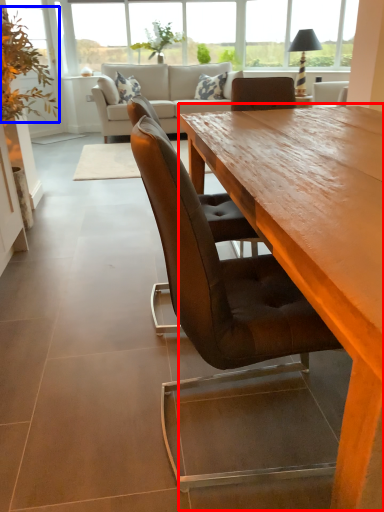
Question: Among these objects, which one is nearest to the camera, coffee table (highlighted by a red box) or plant (highlighted by a blue box)?

Choices:
 (A) coffee table
 (B) plant

Answer: (A)